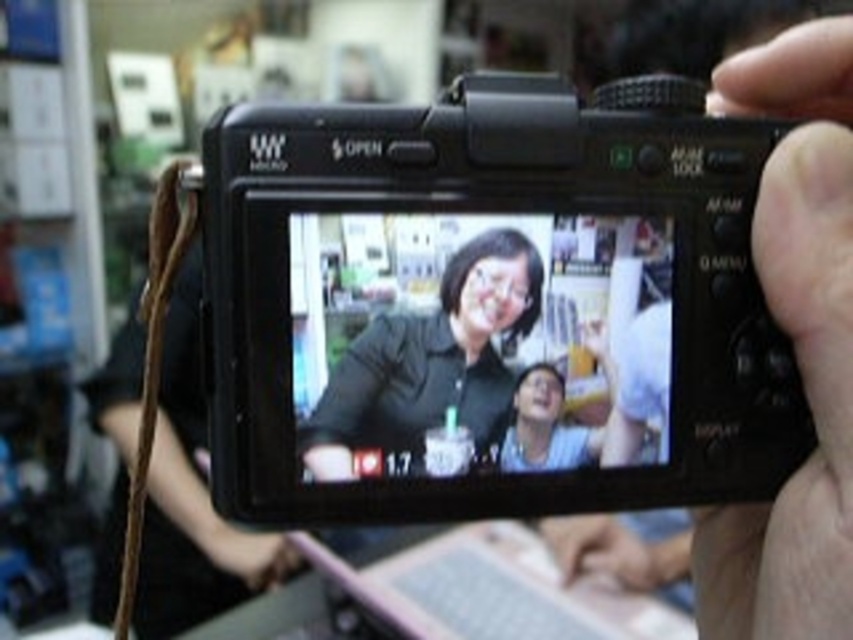
Does black plastic camera at center have a smaller size compared to black matte camera at right?

Yes.

Based on the photo, does black plastic camera at center have a lesser height compared to black matte camera at right?

Correct, black plastic camera at center is not as tall as black matte camera at right.

Which is in front, point (447, 384) or point (843, 259)?

Point (843, 259) is more forward.

Locate an element on the screen. The width and height of the screenshot is (853, 640). black plastic camera at center is located at coordinates (488, 305).

Which is below, black plastic camera at center or matte black shirt at center?

matte black shirt at center is below.

Between black plastic camera at center and matte black shirt at center, which one has more height?

With more height is black plastic camera at center.

Which is in front, point (509, 461) or point (473, 436)?

Point (473, 436) is in front.

This screenshot has height=640, width=853. I want to click on black plastic camera at center, so click(x=488, y=305).

Who is positioned more to the right, black matte camera at right or matte black shirt at center?

black matte camera at right is more to the right.

Does black matte camera at right appear on the left side of matte black shirt at center?

Incorrect, black matte camera at right is not on the left side of matte black shirt at center.

Who is more forward, (827, 385) or (500, 397)?

Point (827, 385) is more forward.

Image resolution: width=853 pixels, height=640 pixels. What are the coordinates of `black matte camera at right` in the screenshot? It's located at (793, 346).